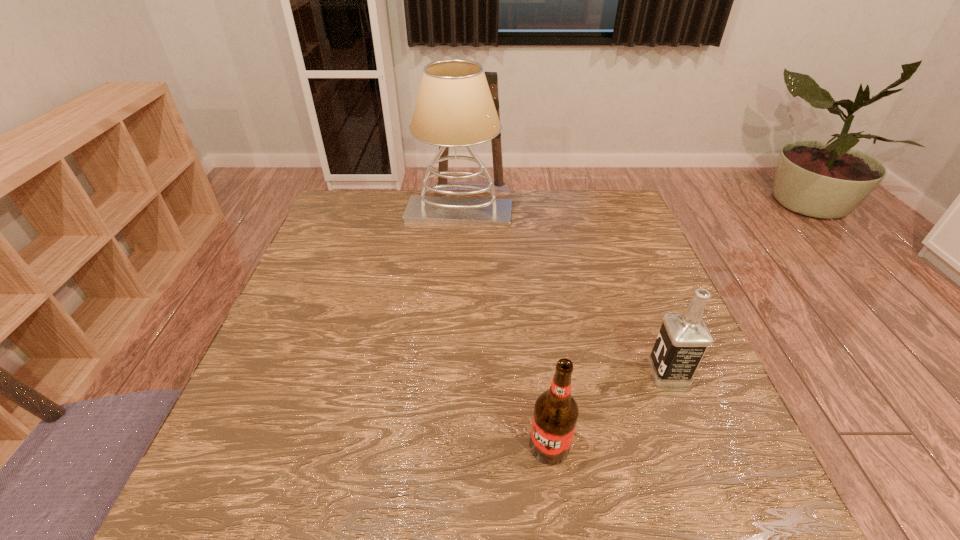
At what (x,y) coordinates should I click in order to perform the action: click on free spot between the rightmost object and the table lamp. Please return your answer as a coordinate pair (x, y). Looking at the image, I should click on (564, 293).

At what (x,y) coordinates should I click in order to perform the action: click on free space that is in between the root beer and the table lamp. Please return your answer as a coordinate pair (x, y). Looking at the image, I should click on (504, 329).

In order to click on free space between the vodka and the root beer in this screenshot , I will do `click(609, 409)`.

The image size is (960, 540). What are the coordinates of `free area in between the farthest object and the rightmost object` in the screenshot? It's located at (564, 293).

Where is `vacant area that lies between the root beer and the table lamp`? This screenshot has width=960, height=540. vacant area that lies between the root beer and the table lamp is located at coordinates (504, 329).

Where is `vacant point located between the root beer and the farthest object`? vacant point located between the root beer and the farthest object is located at coordinates (504, 329).

I want to click on vacant area that lies between the root beer and the farthest object, so click(x=504, y=329).

I want to click on free area in between the nearest object and the second farthest object, so click(609, 409).

Select which object is the closest to the second nearest object. Please provide its 2D coordinates. Your answer should be formatted as a tuple, i.e. [(x, y)], where the tuple contains the x and y coordinates of a point satisfying the conditions above.

[(556, 412)]

Identify which object is located as the nearest to the tallest object. Please provide its 2D coordinates. Your answer should be formatted as a tuple, i.e. [(x, y)], where the tuple contains the x and y coordinates of a point satisfying the conditions above.

[(683, 339)]